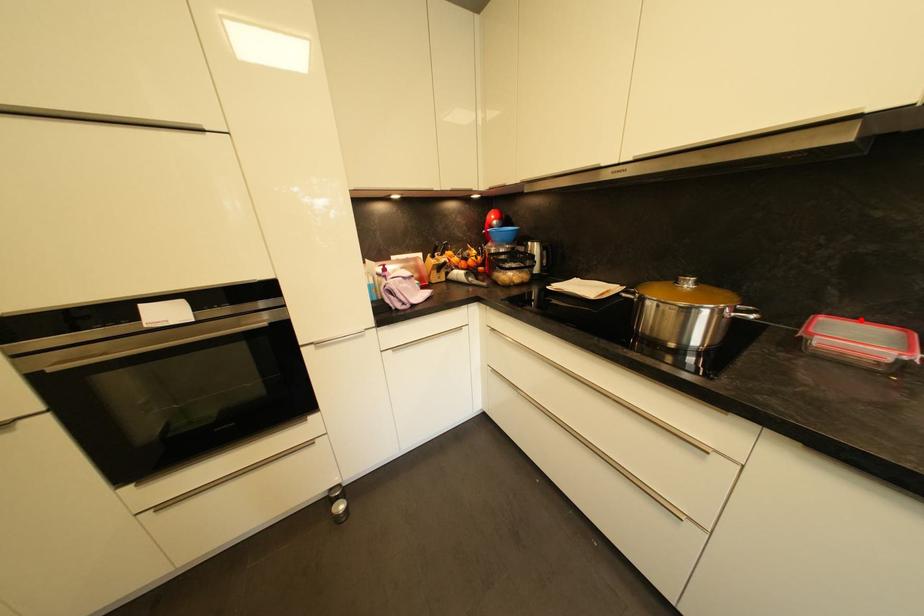
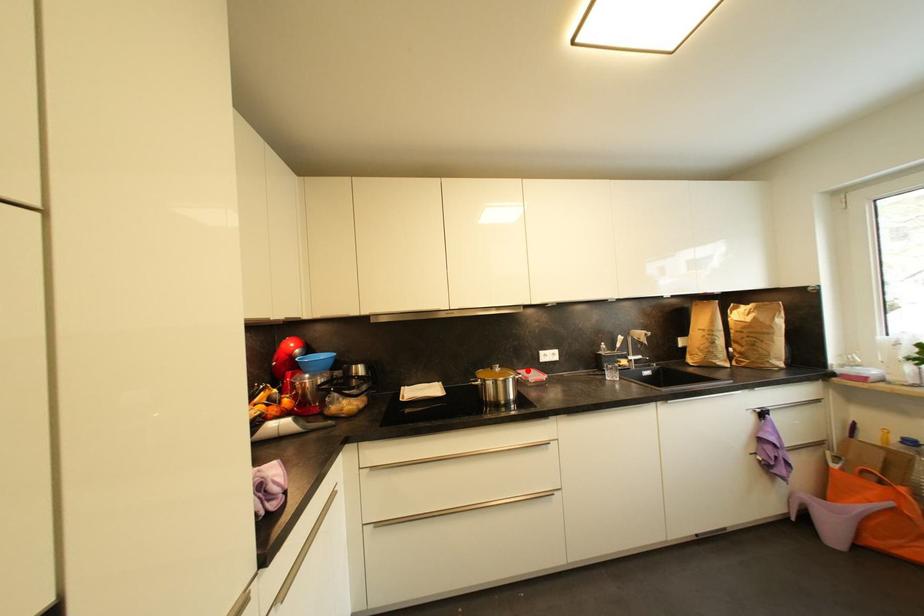
I am providing you with two images of the same scene from different viewpoints. A red point is marked on the first image and another point is marked on the second image. Do the highlighted points in image1 and image2 indicate the same real-world spot?

Yes